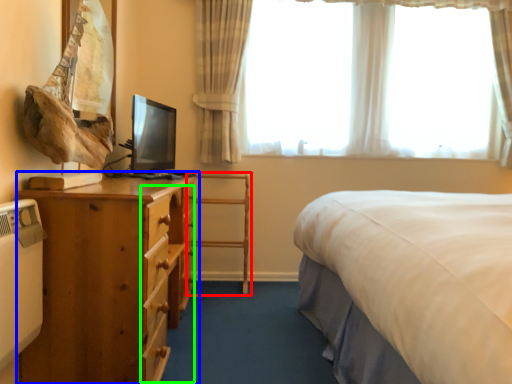
Question: Which is nearer to the chair (highlighted by a red box)? nightstand (highlighted by a blue box) or drawer (highlighted by a green box).

Choices:
 (A) nightstand
 (B) drawer

Answer: (B)